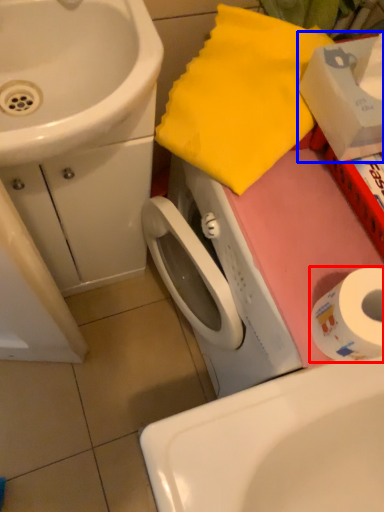
Question: Which object is further to the camera taking this photo, toilet paper (highlighted by a red box) or box (highlighted by a blue box)?

Choices:
 (A) toilet paper
 (B) box

Answer: (A)